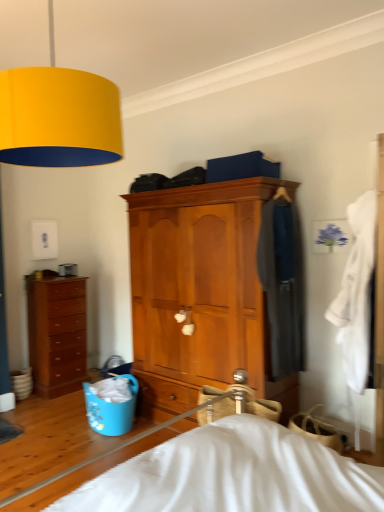
Question: Considering the relative positions of wooden cabinet at center, the 1th chest of drawers from the right, and brown wooden chest of drawers at left, which appears as the first chest of drawers when viewed from the back, in the image provided, is wooden cabinet at center, the 1th chest of drawers from the right, to the left of brown wooden chest of drawers at left, which appears as the first chest of drawers when viewed from the back, from the viewer's perspective?

Choices:
 (A) no
 (B) yes

Answer: (A)

Question: From a real-world perspective, is wooden cabinet at center, the 1th chest of drawers from the right, over brown wooden chest of drawers at left, which is counted as the 1th chest of drawers, starting from the left?

Choices:
 (A) no
 (B) yes

Answer: (B)

Question: Considering the relative sizes of wooden cabinet at center, the 1th chest of drawers from the right, and brown wooden chest of drawers at left, which appears as the first chest of drawers when viewed from the back, in the image provided, is wooden cabinet at center, the 1th chest of drawers from the right, smaller than brown wooden chest of drawers at left, which appears as the first chest of drawers when viewed from the back,?

Choices:
 (A) yes
 (B) no

Answer: (B)

Question: Does wooden cabinet at center, the 2th chest of drawers from the back, appear on the right side of brown wooden chest of drawers at left, which appears as the first chest of drawers when viewed from the back?

Choices:
 (A) yes
 (B) no

Answer: (A)

Question: Is wooden cabinet at center, the 1th chest of drawers from the right, far from brown wooden chest of drawers at left, which appears as the 2th chest of drawers when viewed from the front?

Choices:
 (A) yes
 (B) no

Answer: (A)

Question: From a real-world perspective, is blue plastic laundry basket at lower left above or below brown wooden chest of drawers at left, which appears as the 2th chest of drawers when viewed from the front?

Choices:
 (A) above
 (B) below

Answer: (B)

Question: Relative to brown wooden chest of drawers at left, which appears as the first chest of drawers when viewed from the back, is blue plastic laundry basket at lower left in front or behind?

Choices:
 (A) behind
 (B) front

Answer: (B)

Question: Is blue plastic laundry basket at lower left inside or outside of brown wooden chest of drawers at left, which is counted as the 1th chest of drawers, starting from the left?

Choices:
 (A) inside
 (B) outside

Answer: (B)

Question: Looking at the image, does blue plastic laundry basket at lower left seem bigger or smaller compared to brown wooden chest of drawers at left, the 2th chest of drawers positioned from the right?

Choices:
 (A) big
 (B) small

Answer: (B)

Question: Is brown wooden chest of drawers at left, which is counted as the 1th chest of drawers, starting from the left, spatially inside white cotton robe at right, which ranks as the 1th clothing in front-to-back order, or outside of it?

Choices:
 (A) outside
 (B) inside

Answer: (A)

Question: From the image's perspective, relative to white cotton robe at right, which ranks as the 1th clothing in front-to-back order, is brown wooden chest of drawers at left, which appears as the first chest of drawers when viewed from the back, above or below?

Choices:
 (A) below
 (B) above

Answer: (A)

Question: Looking at the image, does brown wooden chest of drawers at left, the 2th chest of drawers positioned from the right, seem bigger or smaller compared to white cotton robe at right, which ranks as the 1th clothing in front-to-back order?

Choices:
 (A) big
 (B) small

Answer: (A)

Question: Considering the positions of point (52, 366) and point (369, 311), is point (52, 366) closer or farther from the camera than point (369, 311)?

Choices:
 (A) closer
 (B) farther

Answer: (B)

Question: In the image, is wooden cabinet at center, the 1th chest of drawers from the right, on the left side or the right side of brown wooden chest of drawers at left, the 2th chest of drawers positioned from the right?

Choices:
 (A) right
 (B) left

Answer: (A)

Question: Is wooden cabinet at center, the 2th chest of drawers from the back, in front of or behind brown wooden chest of drawers at left, which is counted as the 1th chest of drawers, starting from the left, in the image?

Choices:
 (A) front
 (B) behind

Answer: (A)